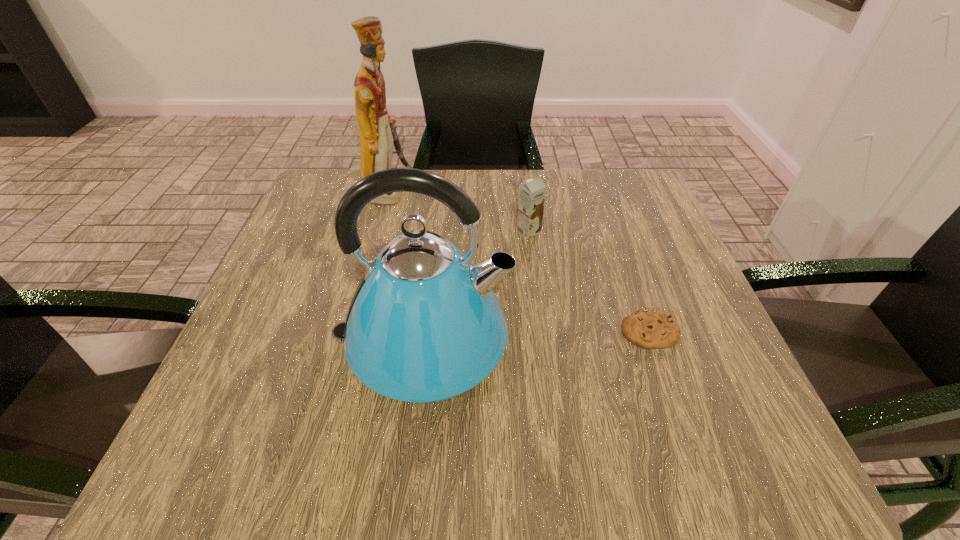
The height and width of the screenshot is (540, 960). Identify the location of nutcracker. coord(377,130).

Where is `kettle`? kettle is located at coordinates (424, 326).

The width and height of the screenshot is (960, 540). I want to click on the second shortest object, so click(x=531, y=198).

Where is `the third object from left to right`? Image resolution: width=960 pixels, height=540 pixels. the third object from left to right is located at coordinates [x=531, y=198].

Locate an element on the screen. cookie is located at coordinates (650, 328).

You are a GUI agent. You are given a task and a screenshot of the screen. Output one action in this format:
    pyautogui.click(x=<x>, y=<y>)
    Task: Click on the shortest object
    
    Given the screenshot: What is the action you would take?
    pyautogui.click(x=650, y=328)

Locate an element on the screen. vacant space located 0.180m on the front-facing side of the farthest object is located at coordinates (483, 192).

Where is `vacant region located 0.310m at the spout of the kettle`? This screenshot has width=960, height=540. vacant region located 0.310m at the spout of the kettle is located at coordinates (692, 344).

The height and width of the screenshot is (540, 960). I want to click on vacant space located on the back of the second farthest object, so click(525, 203).

Where is `free space located on the left of the shortest object`? The width and height of the screenshot is (960, 540). free space located on the left of the shortest object is located at coordinates (569, 331).